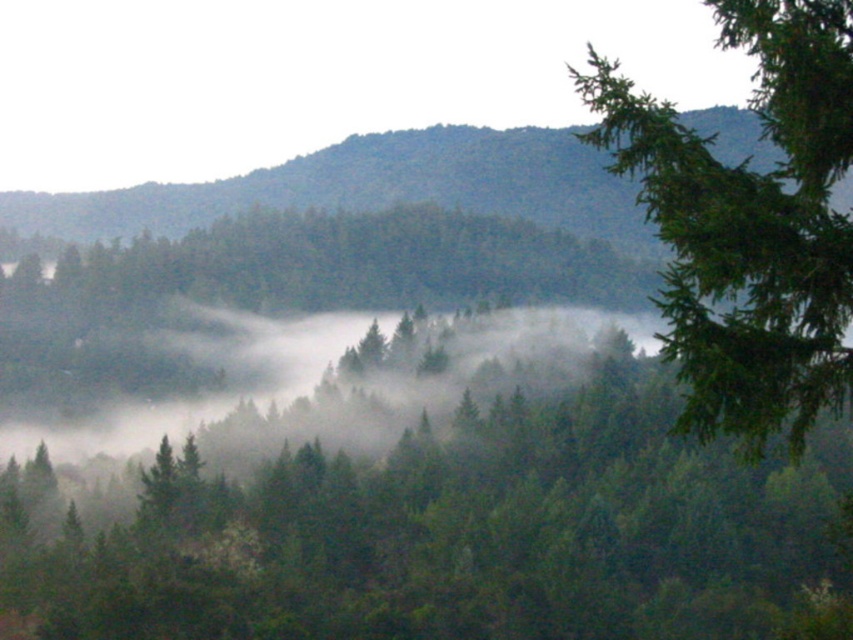
Does green matte tree at center have a greater height compared to green matte hillside at upper center?

In fact, green matte tree at center may be shorter than green matte hillside at upper center.

Which is behind, point (547, 410) or point (741, 144)?

The point (741, 144) is more distant.

This screenshot has height=640, width=853. In order to click on green matte tree at center in this screenshot , I will do `click(440, 509)`.

Between green matte tree at center and green needle-like at upper right, which one has less height?

green matte tree at center

Is point (189, 509) closer to viewer compared to point (677, 212)?

No, (189, 509) is further to viewer.

I want to click on green matte tree at center, so click(x=440, y=509).

I want to click on green matte tree at center, so click(x=440, y=509).

Who is higher up, green needle-like at upper right or green matte hillside at upper center?

green matte hillside at upper center

Does green needle-like at upper right have a greater width compared to green matte hillside at upper center?

Incorrect, green needle-like at upper right's width does not surpass green matte hillside at upper center's.

From the picture: Who is more distant from viewer, [851,157] or [607,220]?

Point [607,220]

Where is `green needle-like at upper right`? The width and height of the screenshot is (853, 640). green needle-like at upper right is located at coordinates (750, 225).